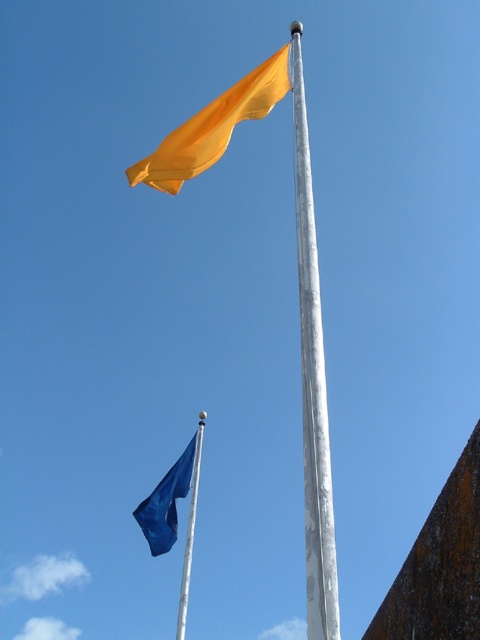
Question: Does blue fabric flag at lower center have a lesser width compared to white wood pole at center?

Choices:
 (A) yes
 (B) no

Answer: (A)

Question: Which point appears farthest from the camera in this image?

Choices:
 (A) (168, 472)
 (B) (184, 566)
 (C) (253, 104)
 (D) (316, 348)

Answer: (A)

Question: Which point is farther to the camera?

Choices:
 (A) blue fabric flag at lower center
 (B) white wood pole at center
 (C) matte yellow flag at upper center
 (D) silver metallic pole at center

Answer: (A)

Question: Can you confirm if matte yellow flag at upper center is wider than blue fabric flag at lower center?

Choices:
 (A) yes
 (B) no

Answer: (A)

Question: Among these points, which one is nearest to the camera?

Choices:
 (A) (223, 125)
 (B) (188, 563)
 (C) (300, 125)
 (D) (167, 492)

Answer: (C)

Question: Does blue fabric flag at lower center appear on the left side of white wood pole at center?

Choices:
 (A) yes
 (B) no

Answer: (B)